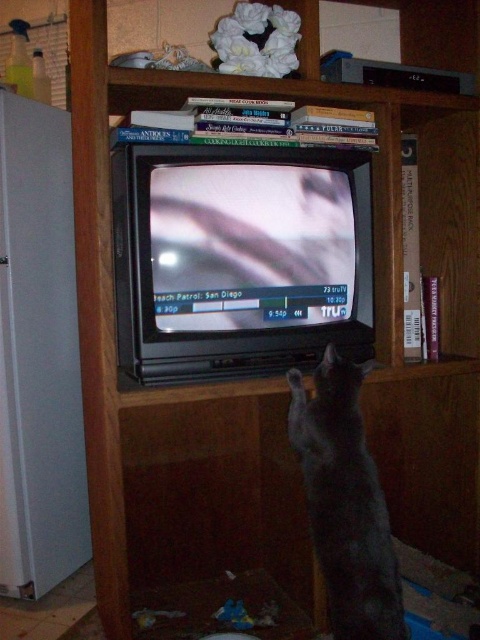
From the picture: You are trying to decide where to place a new rectangular box that is 1 foot thick. You have two options on the left side of the image, near the white matte refrigerator at left and near the shiny gray cat at center. Which location has enough space for the box based on their thickness?

The shiny gray cat at center is thicker than the white matte refrigerator at left. Since the box is 1 foot thick, it would require a space at least as thick as the box. The white matte refrigerator at left is thinner than the shiny gray cat at center, so the space near the shiny gray cat at center has more thickness and can accommodate the 1 foot thick box.

You are standing in front of the entertainment unit and want to place a small plant between the two points, point (x=70, y=410) and point (x=289, y=426). Which point should the plant be closer to in order to be nearer to the front of the entertainment unit?

The plant should be placed closer to point (x=70, y=410) because it is further to the camera than point (x=289, y=426), making it nearer to the front of the entertainment unit.

You are moving a small box that is 1 foot wide. You need to place it between the white matte refrigerator at left and the shiny gray cat at center. Can the box fit in the space between them?

The white matte refrigerator at left is larger than the shiny gray cat at center, so the space between them may vary. However, since the refrigerator is larger, it might take up more room, potentially leaving enough space for the 1 foot wide box. Without exact measurements, it is uncertain, but the box might fit.